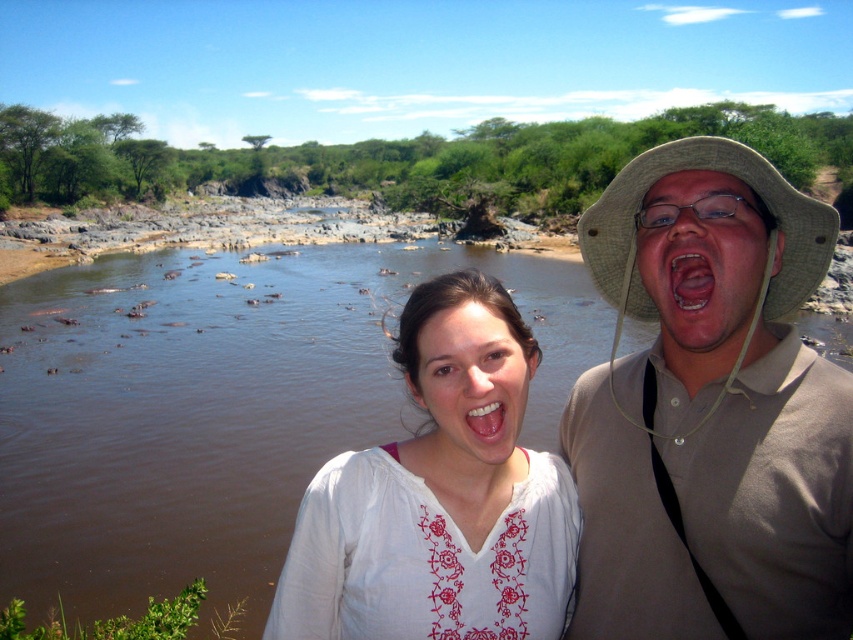
How distant is matte khaki hat at center from pink flesh at center?

matte khaki hat at center and pink flesh at center are 2.62 inches apart.

Which is in front, point (730, 282) or point (683, 248)?

Point (683, 248)

Where is `matte khaki hat at center`? matte khaki hat at center is located at coordinates (703, 275).

Is white embroidered shirt at center further to camera compared to pink flesh at center?

Yes, white embroidered shirt at center is behind pink flesh at center.

Does point (456, 522) come in front of point (677, 310)?

No, (456, 522) is further to viewer.

The height and width of the screenshot is (640, 853). I want to click on white embroidered shirt at center, so click(x=439, y=499).

Which is behind, point (485, 337) or point (662, 304)?

Point (485, 337)

Image resolution: width=853 pixels, height=640 pixels. In order to click on white fabric face at center in this screenshot , I will do `click(468, 392)`.